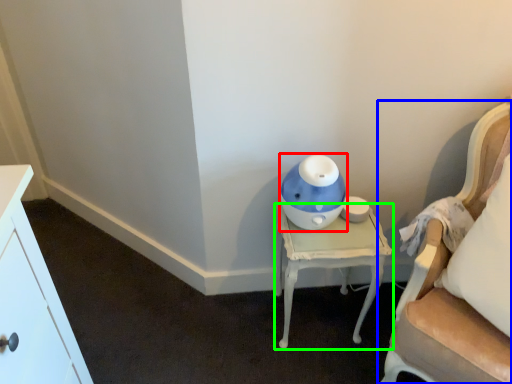
Question: Based on their relative distances, which object is nearer to toy (highlighted by a red box)? Choose from chair (highlighted by a blue box) and nightstand (highlighted by a green box).

Choices:
 (A) chair
 (B) nightstand

Answer: (B)